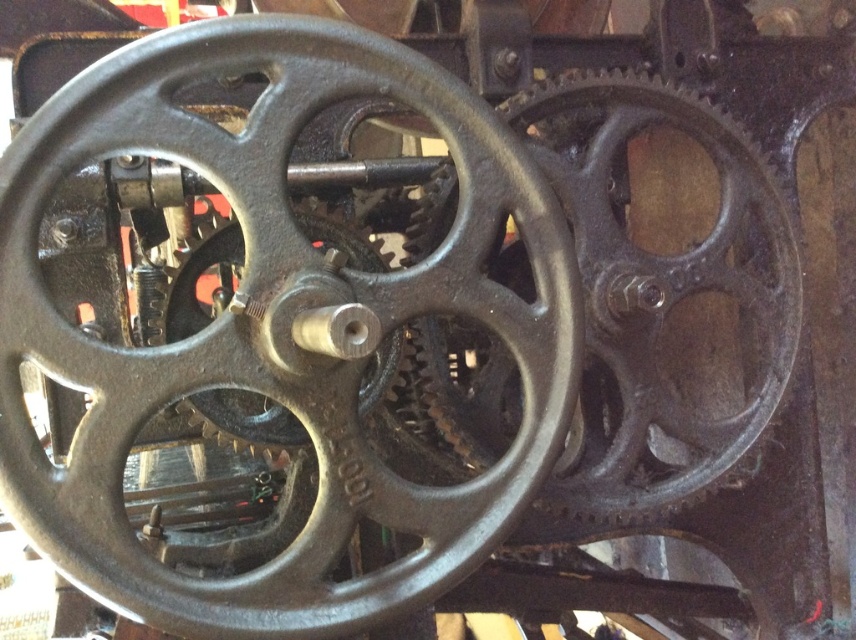
Does black cast iron wheel at center appear over matte black gear at center?

Actually, black cast iron wheel at center is below matte black gear at center.

Can you confirm if black cast iron wheel at center is shorter than matte black gear at center?

No, black cast iron wheel at center is not shorter than matte black gear at center.

Is point (211, 324) farther from viewer compared to point (634, 380)?

No, it is in front of (634, 380).

Find the location of a particular element. Image resolution: width=856 pixels, height=640 pixels. black cast iron wheel at center is located at coordinates (277, 328).